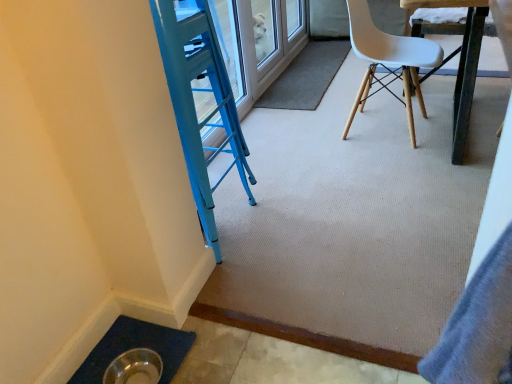
This screenshot has height=384, width=512. What are the coordinates of `vacant space that is in between white plastic chair at upper right and metallic dark brown table at upper right` in the screenshot? It's located at (376, 117).